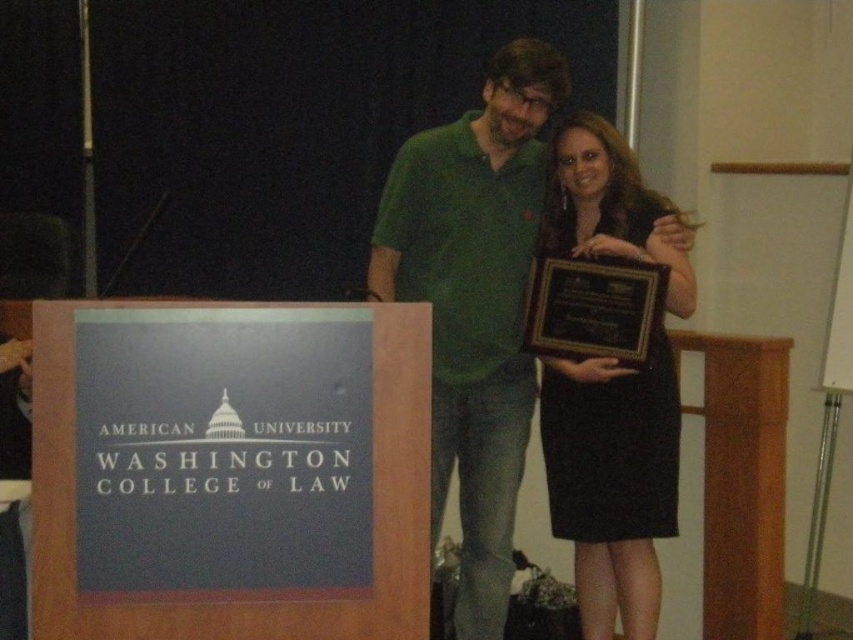
Which is above, blue cardboard sign at left or black polished wood plaque at center?

black polished wood plaque at center is above.

Which is in front, point (318, 472) or point (589, 296)?

Positioned in front is point (318, 472).

Measure the distance between point (242, 561) and camera.

They are 2.35 meters apart.

You are a GUI agent. You are given a task and a screenshot of the screen. Output one action in this format:
    pyautogui.click(x=<x>, y=<y>)
    Task: Click on the blue cardboard sign at left
    The width and height of the screenshot is (853, 640).
    Given the screenshot: What is the action you would take?
    pyautogui.click(x=230, y=472)

Image resolution: width=853 pixels, height=640 pixels. Identify the location of matte green shirt at center. (474, 301).

Does matte green shirt at center appear under black satin dress at center?

No, matte green shirt at center is not below black satin dress at center.

Is point (486, 515) more distant than point (560, 410)?

No.

Where is `matte green shirt at center`? Image resolution: width=853 pixels, height=640 pixels. matte green shirt at center is located at coordinates (474, 301).

Can you confirm if blue cardboard sign at left is smaller than matte green shirt at center?

Yes.

Between blue cardboard sign at left and matte green shirt at center, which one is positioned lower?

blue cardboard sign at left

Is point (364, 371) in front of point (436, 237)?

Yes.

I want to click on blue cardboard sign at left, so click(230, 472).